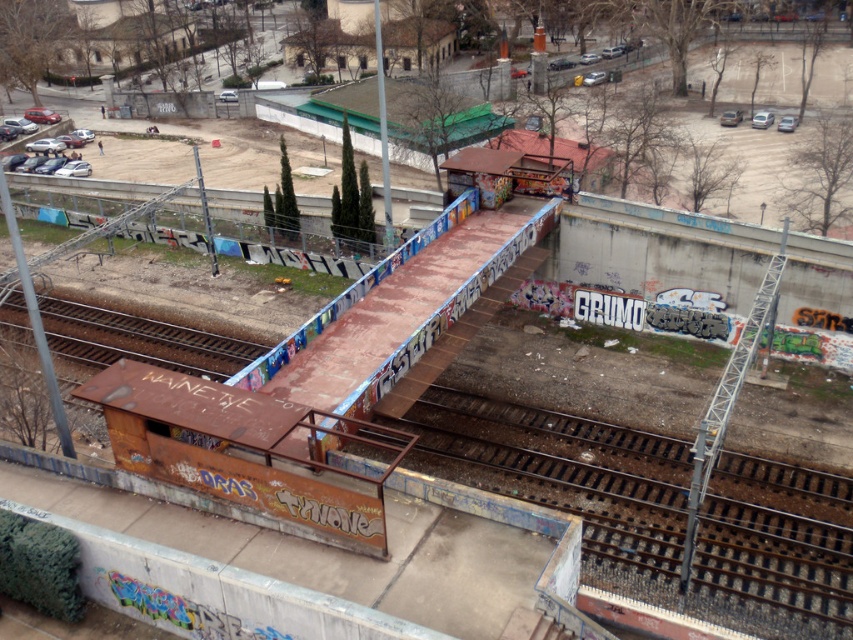
In the scene shown: You are a painter who needs to paint both the rusty metal train track at lower center and the rusty metal train track at lower left. Which track requires more paint due to its larger width?

The rusty metal train track at lower center requires more paint because its width is larger than the rusty metal train track at lower left.

You are standing at the point closer to the camera in the image. Which point are you at, point (639, 561) or point (216, 362)?

You are at point (639, 561) because it is closer to the camera than point (216, 362).